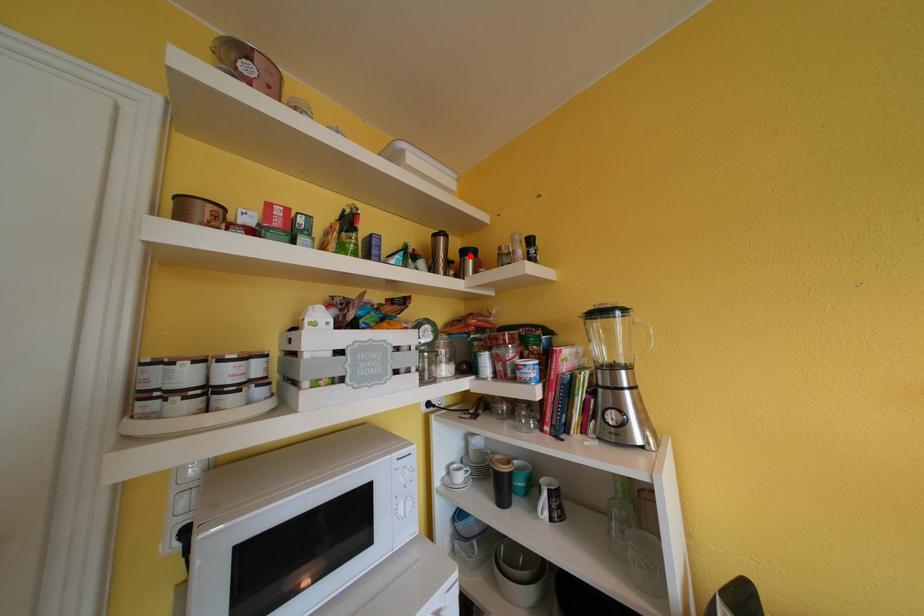
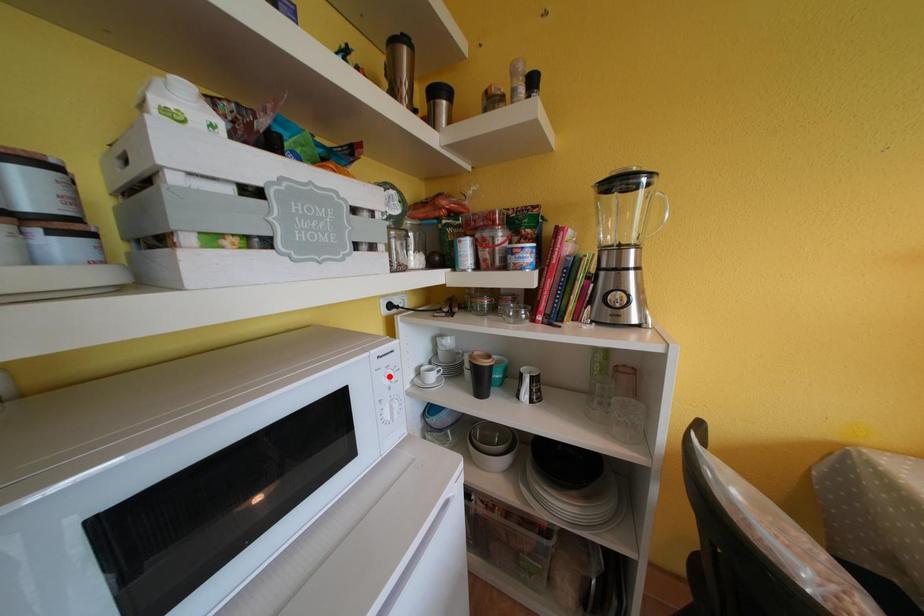
I am providing you with two images of the same scene from different viewpoints. A red point is marked on the first image and another point is marked on the second image. Do the highlighted points in image1 and image2 indicate the same real-world spot?

No